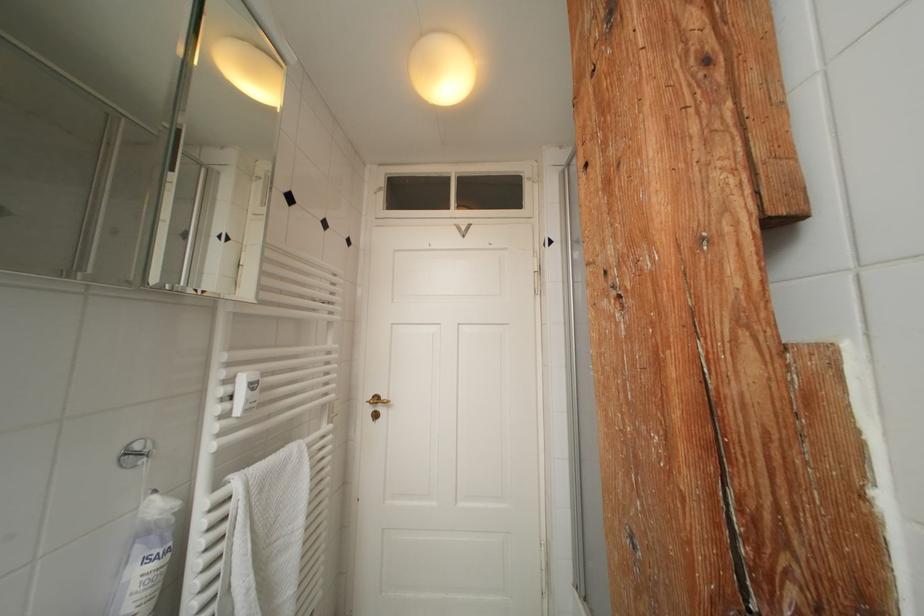
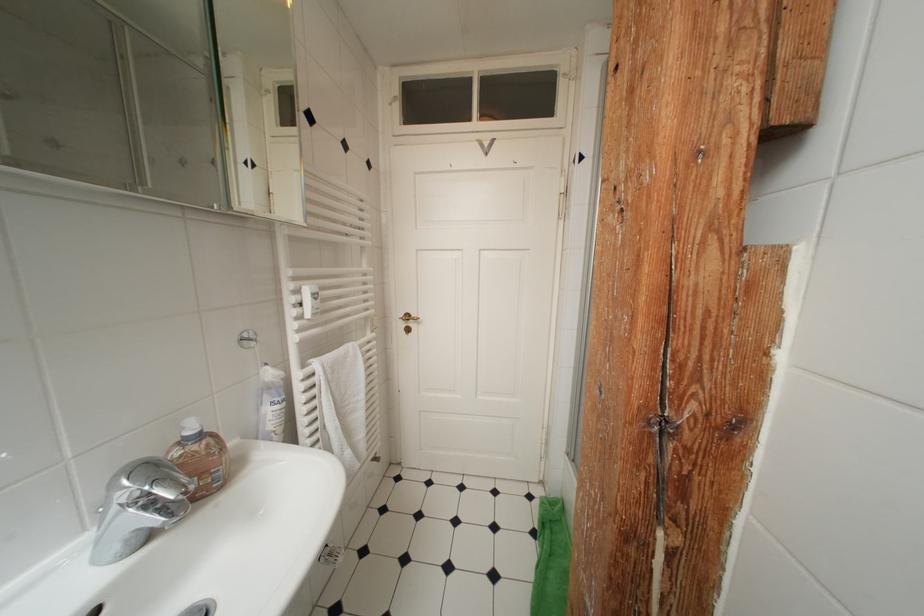
The point at [162,493] is marked in the first image. Where is the corresponding point in the second image?

(274, 368)